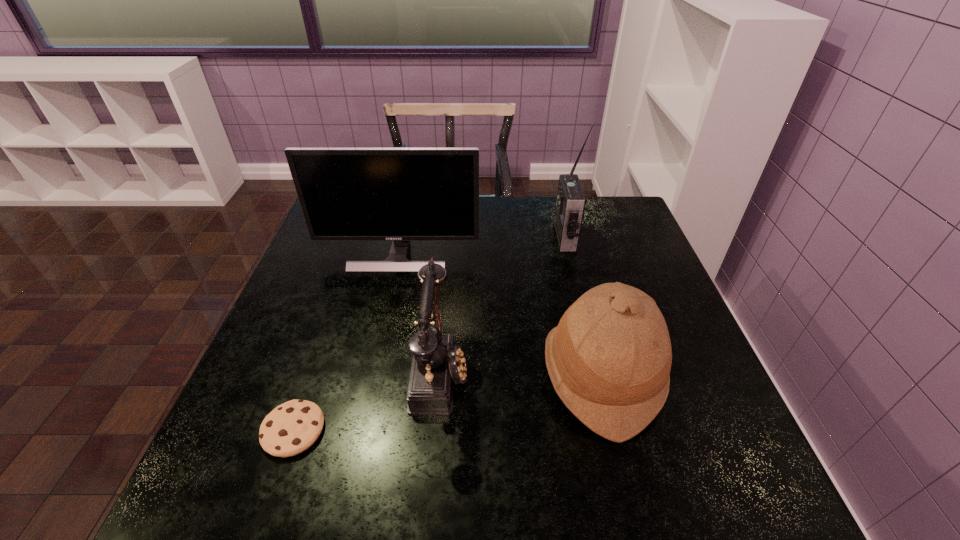
The height and width of the screenshot is (540, 960). I want to click on object at the far left corner, so click(400, 194).

In order to click on object positioned at the near left corner in this screenshot , I will do `click(292, 427)`.

Where is `free space at the far edge`? free space at the far edge is located at coordinates (480, 213).

This screenshot has width=960, height=540. Find the location of `free space at the near edge`. free space at the near edge is located at coordinates (457, 510).

Find the location of a particular element. The width and height of the screenshot is (960, 540). vacant region at the left edge of the desktop is located at coordinates (348, 253).

Locate an element on the screen. vacant space at the right edge of the desktop is located at coordinates (590, 244).

Identify the location of vacant region at the near left corner of the desktop. (298, 468).

Where is `vacant space at the far right corner of the desktop`? vacant space at the far right corner of the desktop is located at coordinates (601, 222).

The width and height of the screenshot is (960, 540). In the image, there is a desktop. What are the coordinates of `vacant space at the near right corner` in the screenshot? It's located at (686, 497).

You are a GUI agent. You are given a task and a screenshot of the screen. Output one action in this format:
    pyautogui.click(x=<x>, y=<y>)
    Task: Click on the empty space between the radio receiver and the telephone
    Image resolution: width=960 pixels, height=540 pixels.
    Given the screenshot: What is the action you would take?
    pyautogui.click(x=503, y=303)